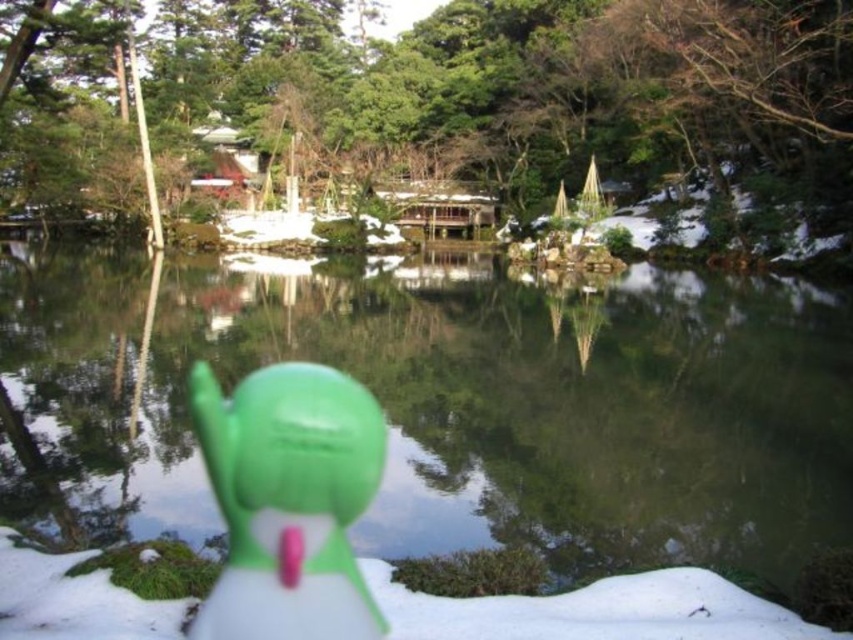
You are a photographer planning to take a photo of the clear glass water at center and the green matte tree at upper center. Given that your camera can only focus on objects within a 100 feet range, will both objects be in focus?

The clear glass water at center and green matte tree at upper center are 117.27 feet apart, which exceeds the camera focus range of 100 feet. Therefore, both objects cannot be in focus simultaneously.

You are a photographer trying to capture the green toy duck in the foreground. You notice a point marked at coordinates (439,100). What object is located at that point?

The point at coordinates (439,100) indicates the green matte tree at upper center.